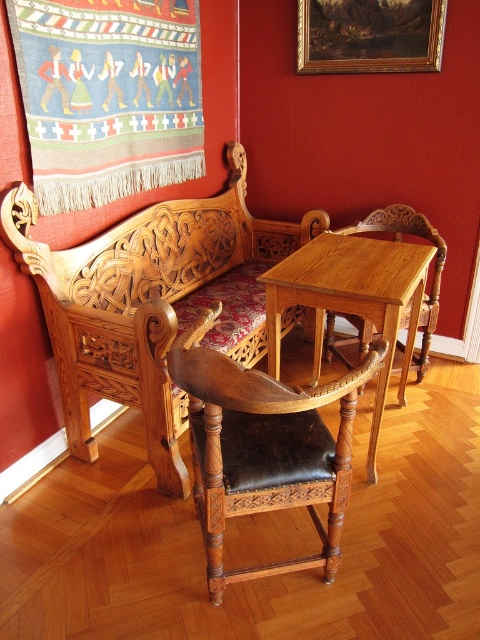
Can you confirm if light brown wood table at center is thinner than wooden armchair at center?

Incorrect, light brown wood table at center's width is not less than wooden armchair at center's.

Is light brown wood table at center above wooden armchair at center?

No, light brown wood table at center is not above wooden armchair at center.

The height and width of the screenshot is (640, 480). Identify the location of light brown wood table at center. (350, 300).

Which is above, dark brown leather chair at center or light brown wood table at center?

light brown wood table at center

Can you confirm if dark brown leather chair at center is positioned to the right of light brown wood table at center?

No, dark brown leather chair at center is not to the right of light brown wood table at center.

The width and height of the screenshot is (480, 640). Describe the element at coordinates (264, 448) in the screenshot. I see `dark brown leather chair at center` at that location.

Identify the location of dark brown leather chair at center. coord(264,448).

Does knitted wool tapestry at upper left have a greater width compared to wooden armchair at center?

In fact, knitted wool tapestry at upper left might be narrower than wooden armchair at center.

You are a GUI agent. You are given a task and a screenshot of the screen. Output one action in this format:
    pyautogui.click(x=<x>, y=<y>)
    Task: Click on the knitted wool tapestry at upper left
    
    Given the screenshot: What is the action you would take?
    pyautogui.click(x=108, y=97)

Which is in front, point (33, 93) or point (429, 314)?

Point (33, 93)

Find the location of a particular element. This screenshot has width=480, height=640. knitted wool tapestry at upper left is located at coordinates (108, 97).